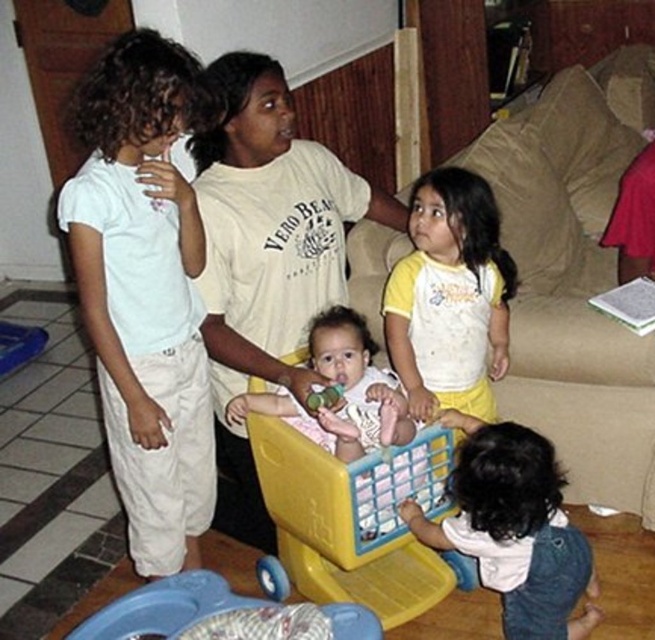
You are a parent trying to decide whether to let your child ride in the yellow plastic shopping cart at center. Considering the height of the soft white baby at center, do you think the cart is tall enough to prevent the baby from slipping out?

The yellow plastic shopping cart at center is much taller than the soft white baby at center, so the cart is tall enough to prevent the baby from slipping out.